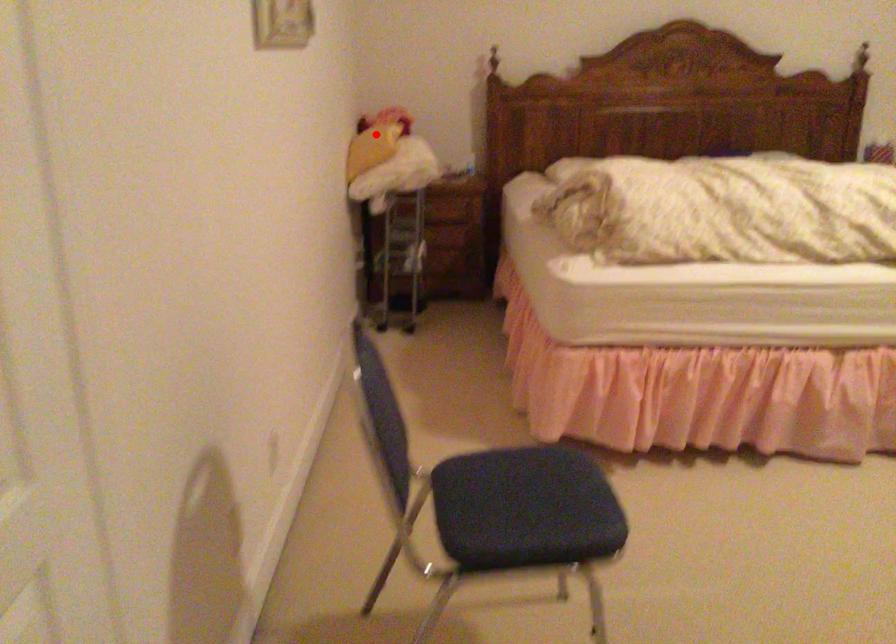
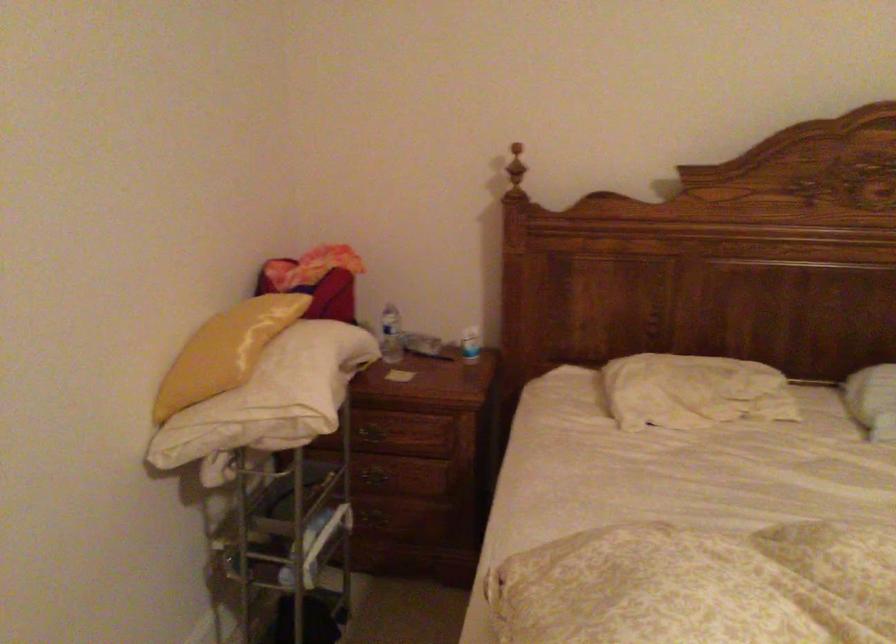
Question: I am providing you with two images of the same scene from different viewpoints. Given a red point in image1, look at the same physical point in image2. Is it:

Choices:
 (A) Closer to the viewpoint
 (B) Farther from the viewpoint

Answer: (A)